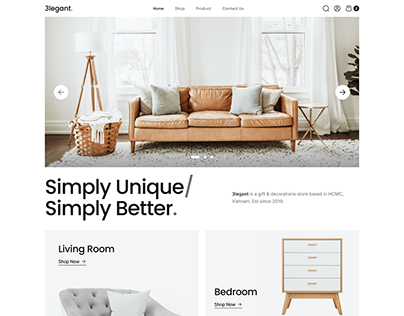
Image resolution: width=404 pixels, height=316 pixels. I want to click on laundry basket, so click(96, 130).